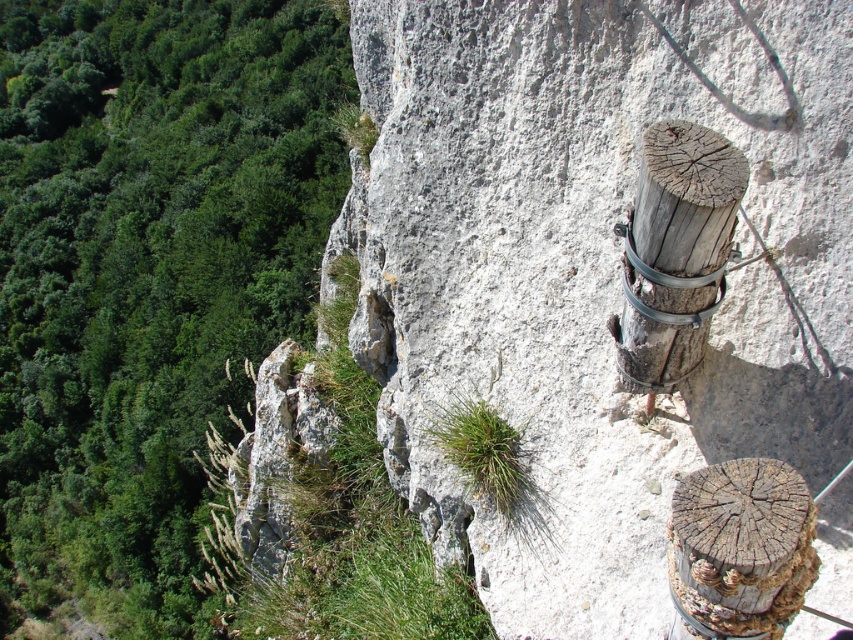
You are a hiker who wants to place a 30 meter long safety rope between the smooth gray rock at center and the green leafy vegetation at left. Can you determine if the rope will be long enough to stretch between them?

The smooth gray rock at center is 35.44 meters from the green leafy vegetation at left. The rope is only 30 meters long, so it will not be long enough to stretch between them.

Based on the scene description, what is located at the coordinates point [593,269]?

The smooth gray rock at center is located at point [593,269].

You are a hiker trying to navigate between the smooth gray rock at center and the weathered wood post at right. If your backpack is 5 feet wide, can you safely pass through the space between them without touching either object?

The smooth gray rock at center is 5.34 feet away from the weathered wood post at right. Since your backpack is 5 feet wide, there is enough space to pass through safely without touching either object.